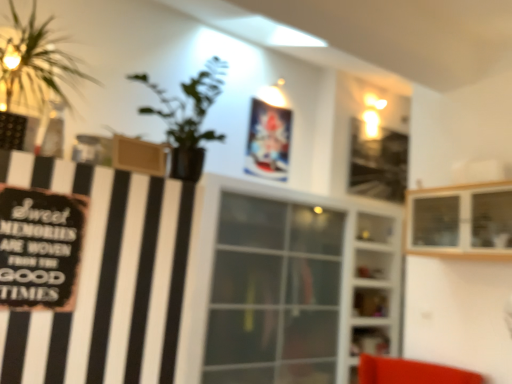
Question: Considering their positions, is transparent glass window at center located in front of or behind green leafy plant at left?

Choices:
 (A) behind
 (B) front

Answer: (A)

Question: Based on their sizes in the image, would you say transparent glass window at center is bigger or smaller than green leafy plant at left?

Choices:
 (A) small
 (B) big

Answer: (B)

Question: Which object is positioned farthest from the black matte signboard at left?

Choices:
 (A) wooden cabinet at upper right, placed as the first shelf when sorted from top to bottom
 (B) green leafy plant at left
 (C) transparent glass window at center
 (D) transparent glass shelves at center, the 1th shelf when ordered from bottom to top

Answer: (D)

Question: Which of these objects is positioned closest to the transparent glass window at center?

Choices:
 (A) transparent glass shelves at center, which ranks as the 2th shelf in front-to-back order
 (B) wooden cabinet at upper right, the second shelf ordered from the bottom
 (C) black matte signboard at left
 (D) green leafy plant at left

Answer: (A)